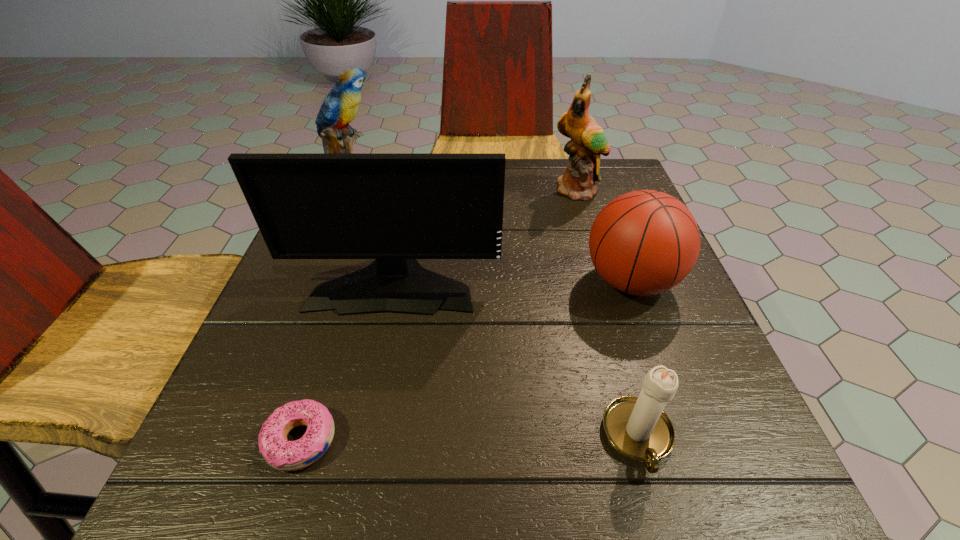
Locate an element on the screen. free space that satisfies the following two spatial constraints: 1. on the face of the basketball; 2. on the left side of the left parrot is located at coordinates pos(323,281).

Locate an element on the screen. The image size is (960, 540). vacant region that satisfies the following two spatial constraints: 1. on the front-facing side of the basketball; 2. on the right side of the right parrot is located at coordinates (x=606, y=281).

Find the location of `vacant space that satisfies the following two spatial constraints: 1. on the face of the left parrot; 2. on the back side of the third shortest object`. vacant space that satisfies the following two spatial constraints: 1. on the face of the left parrot; 2. on the back side of the third shortest object is located at coordinates (323, 281).